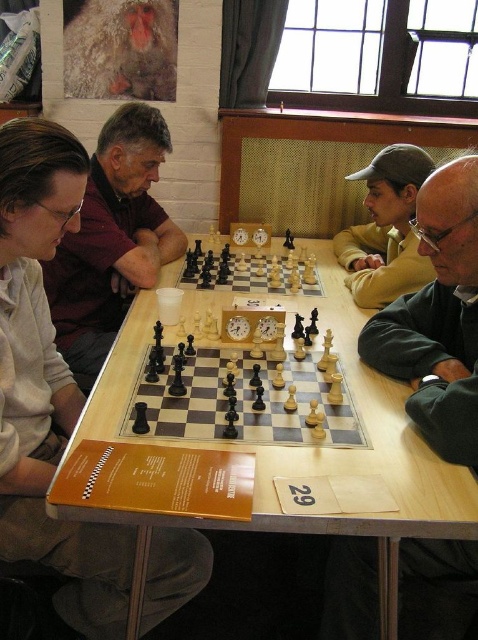
You are a photographer taking a picture of the chess match. You want to ensure both points, point (232, 381) and point (390, 273), are clearly visible in the frame. Which point should you focus on first to ensure depth of field captures both?

Point (232, 381) is closer to the viewer than point (390, 273). To ensure both are in focus, focus on the closer point first, which is point (232, 381), as depth of field extends beyond the point of focus.

You are a photographer taking a picture of the chess match. The khaki cotton cap at upper right is blocking part of the chessboard. To avoid the cap, should you move your camera slightly to the left or right?

The khaki cotton cap at upper right is located at point [386,228]. To avoid the cap, move the camera slightly to the left.

You are a photographer standing 40 inches away from a wooden chessboard at center. Can you take a clear photo of it without moving closer?

The wooden chessboard at center is 38.42 inches away from the camera, which is within the 40 inches distance you are standing. Therefore, you can take a clear photo of it without moving closer.